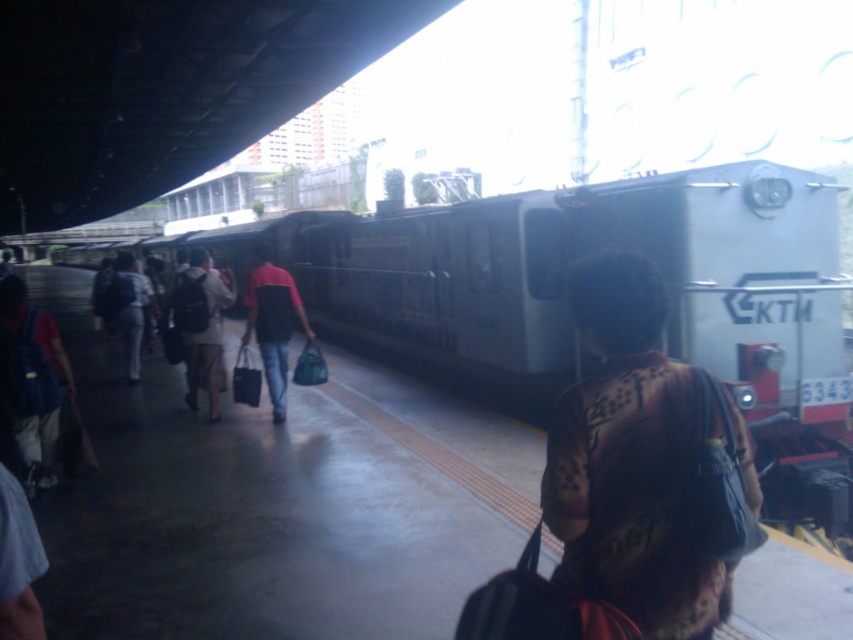
You are standing on the train station platform and want to take a photo that includes both the point at coordinates point (700, 396) and the point at coordinates point (184, 342). Considering their positions, which point should you focus on first to ensure both are in the frame?

You should focus on point (700, 396) first because it is closer to the camera than point (184, 342), ensuring both points are within the frame.

You are a delivery robot with a 2.5 meter arm reach. You need to pick up both the matte black backpack at left and the dark red shirt at center. Can your arm reach both items at the same time?

The matte black backpack at left and the dark red shirt at center are 2.35 meters apart, so yes, the delivery robot can reach both items at the same time since its arm has a 2.5 meter reach.

What object is located at the coordinates point (x=566, y=310)?

The point (x=566, y=310) corresponds to the silver metallic train at center.